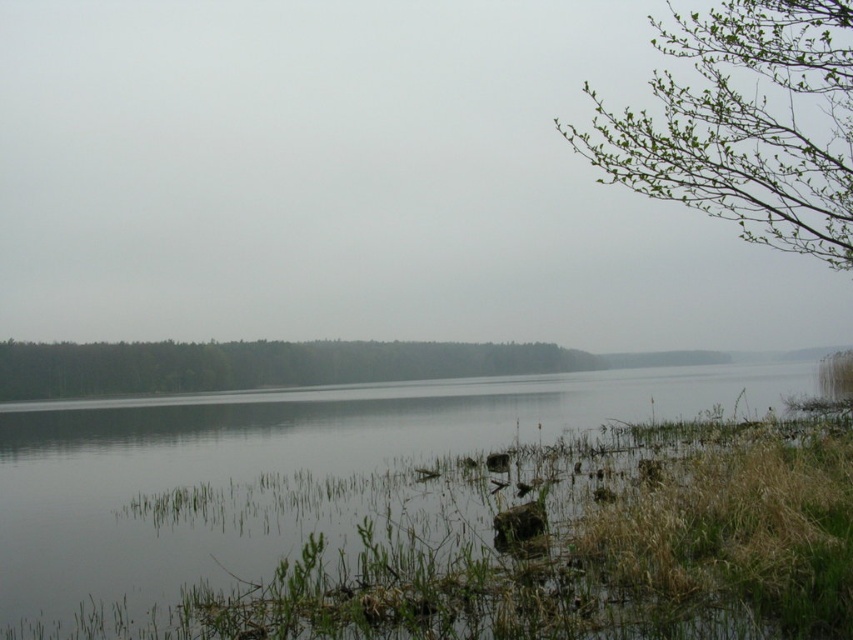
Question: Which of the following is the farthest from the observer?

Choices:
 (A) (264, 358)
 (B) (482, 456)
 (C) (796, 208)

Answer: (A)

Question: Is clear water at center bigger than green leafy branch at upper right?

Choices:
 (A) no
 (B) yes

Answer: (A)

Question: Is clear water at center thinner than green leafy forest at center?

Choices:
 (A) yes
 (B) no

Answer: (B)

Question: Which of the following is the farthest from the observer?

Choices:
 (A) green leafy branch at upper right
 (B) clear water at center
 (C) green leafy forest at center

Answer: (C)

Question: Observing the image, what is the correct spatial positioning of clear water at center in reference to green leafy forest at center?

Choices:
 (A) below
 (B) above

Answer: (A)

Question: Which is farther from the green leafy branch at upper right?

Choices:
 (A) clear water at center
 (B) green leafy forest at center

Answer: (B)